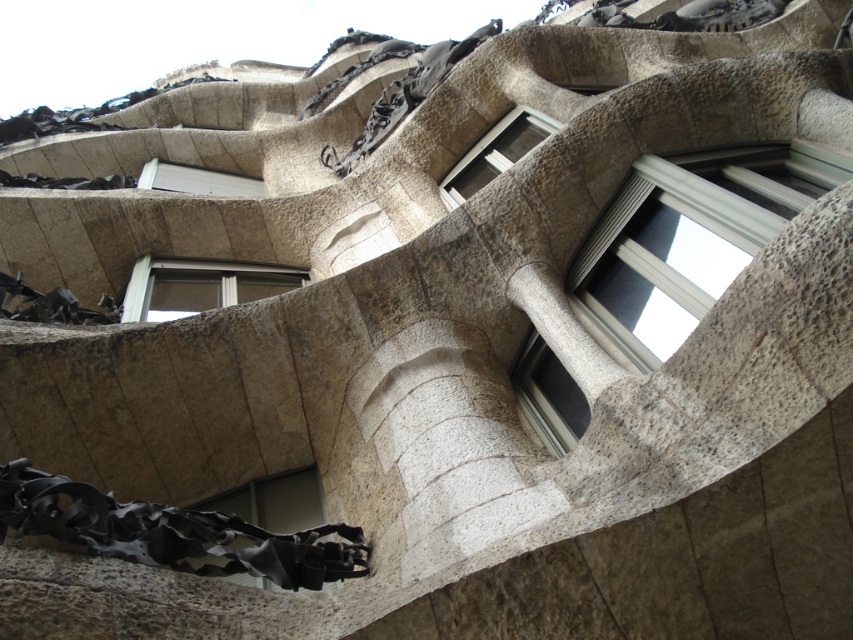
Question: Which of the following is the closest to the observer?

Choices:
 (A) (585, 417)
 (B) (288, 492)

Answer: (A)

Question: Is matte stone window at center closer to camera compared to clear glass window at center?

Choices:
 (A) no
 (B) yes

Answer: (A)

Question: Which of the following is the farthest from the observer?

Choices:
 (A) (532, 396)
 (B) (229, 186)

Answer: (B)

Question: Estimate the real-world distances between objects in this image. Which object is closer to the clear glass window at upper center?

Choices:
 (A) matte black window at lower left
 (B) white plastic window at upper center

Answer: (B)

Question: Does matte stone window at center appear on the left side of white plastic window at upper center?

Choices:
 (A) no
 (B) yes

Answer: (A)

Question: Does clear glass window at center come behind matte black window at lower left?

Choices:
 (A) yes
 (B) no

Answer: (A)